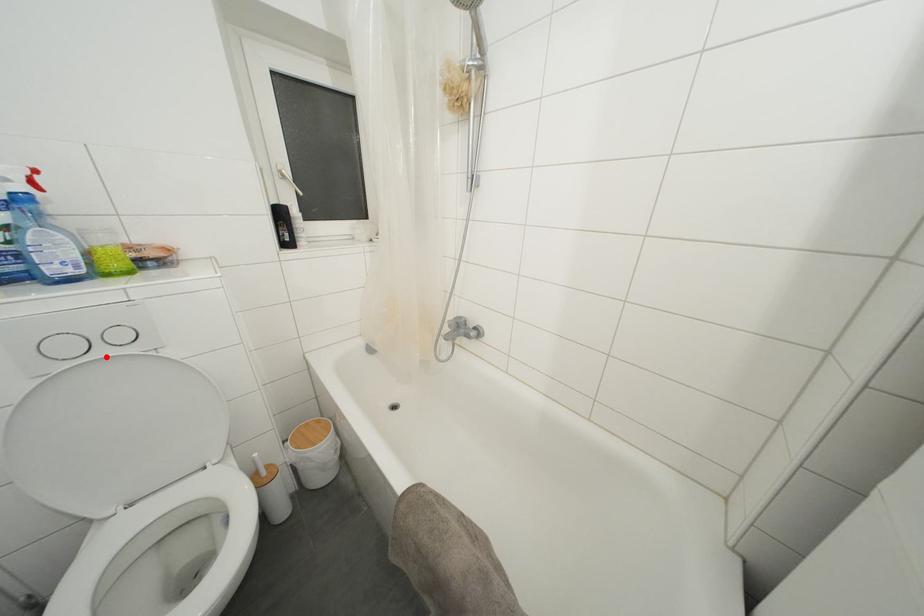
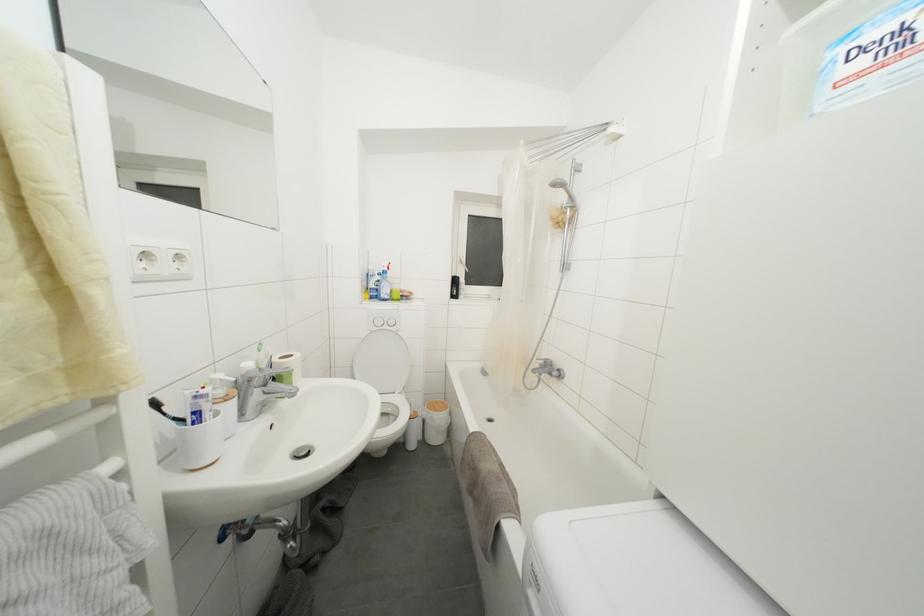
Locate, in the second image, the point that corresponds to the highlighted location in the first image.

(390, 331)